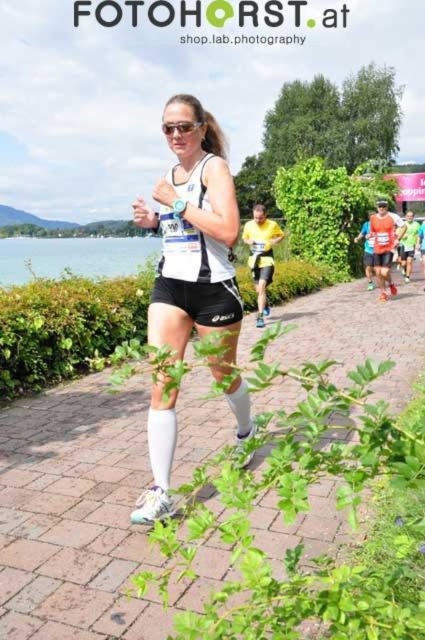
You are a runner participating in a marathon along the lakeside path. You notice two points marked on the path ahead of you at coordinates point (x=410, y=381) and point (x=263, y=221). Which point should you aim to reach first if you want to follow the correct path sequence?

You should aim to reach point (x=263, y=221) first because point (x=410, y=381) is in front of it, meaning point (x=263, y=221) comes before point (x=410, y=381) in the path sequence.

You are a photographer at the marathon event. You want to capture a photo of the runner wearing the white matte running shorts at center and the yellow fabric shirt at center. Which piece of clothing appears smaller in the photo?

The white matte running shorts at center appears smaller than the yellow fabric shirt at center in the photo.

Based on the scene description, can you determine if the white fabric shorts at center are wider than the yellow fabric shirt at center?

The white fabric shorts at center might be wider than yellow fabric shirt at center according to the objects description.